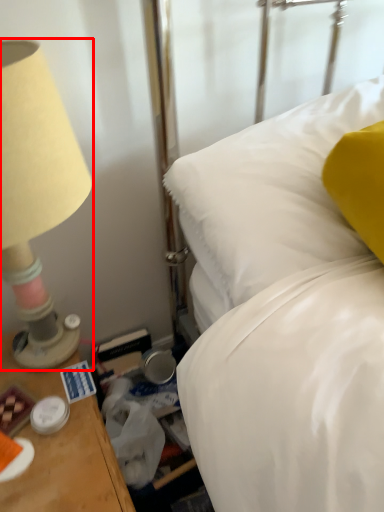
Question: From the image's perspective, what is the correct spatial relationship of lamp (annotated by the red box) in relation to bed?

Choices:
 (A) below
 (B) above

Answer: (A)